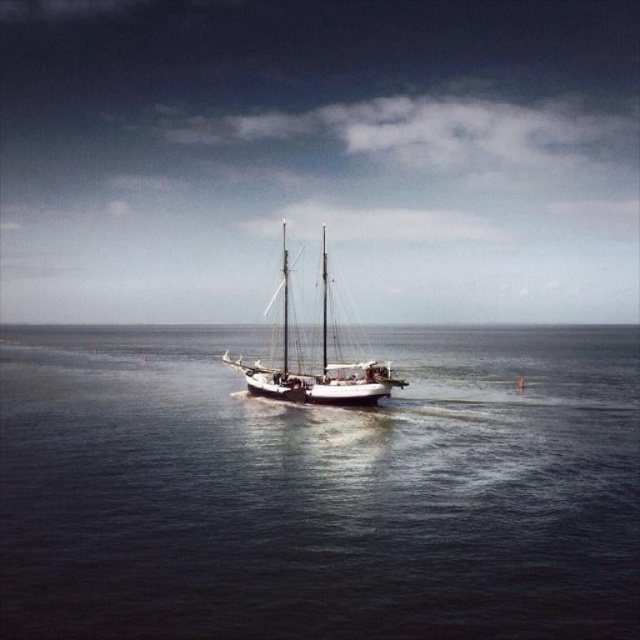
Does dark blue water at center have a lesser width compared to white wooden sailboat at center?

In fact, dark blue water at center might be wider than white wooden sailboat at center.

Can you confirm if dark blue water at center is positioned to the left of white wooden sailboat at center?

Incorrect, dark blue water at center is not on the left side of white wooden sailboat at center.

Between point (1, 436) and point (323, 326), which one is positioned behind?

The point (323, 326) is more distant.

Locate an element on the screen. The image size is (640, 640). dark blue water at center is located at coordinates (320, 490).